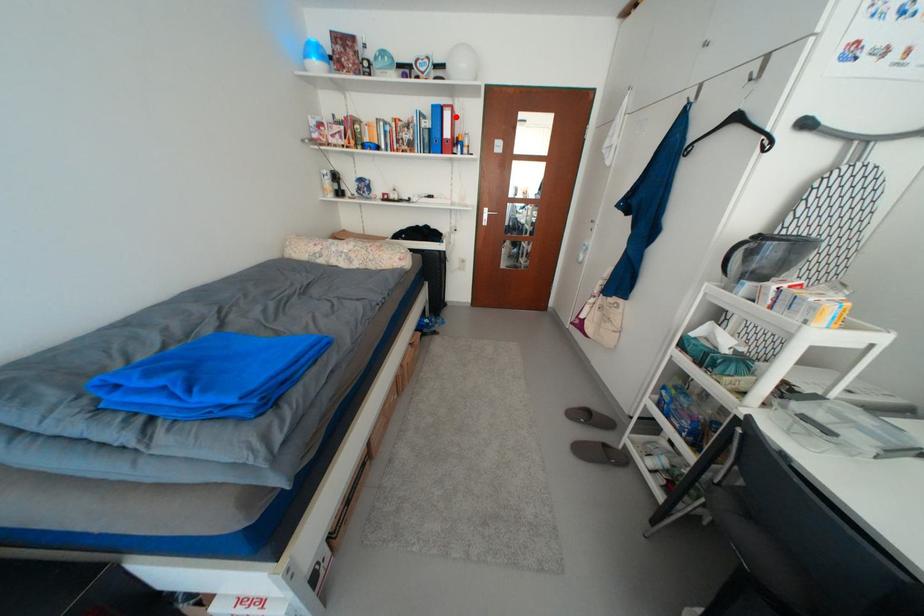
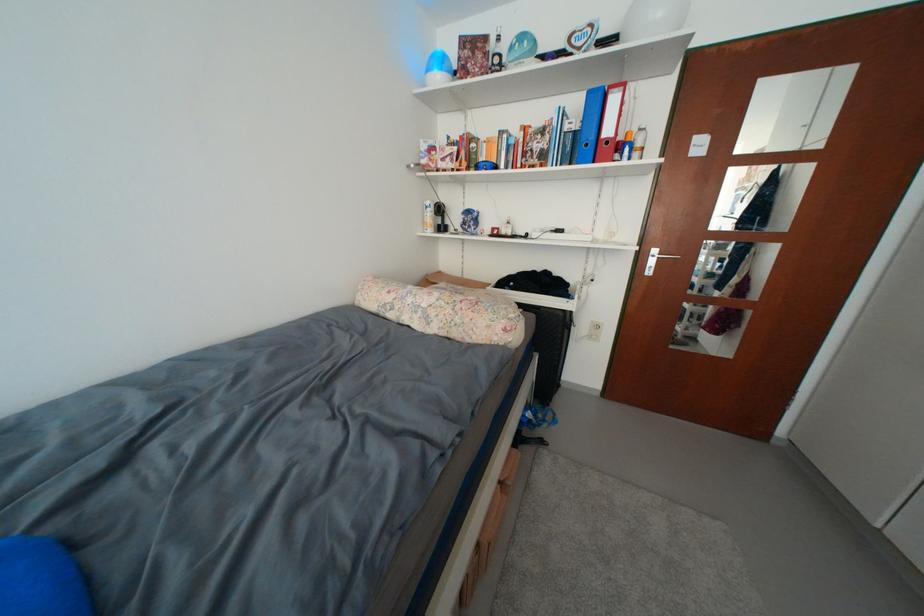
Question: I am providing you with two images of the same scene from different viewpoints. Given a red point in image1, look at the same physical point in image2. Is it:

Choices:
 (A) Closer to the viewpoint
 (B) Farther from the viewpoint

Answer: (B)